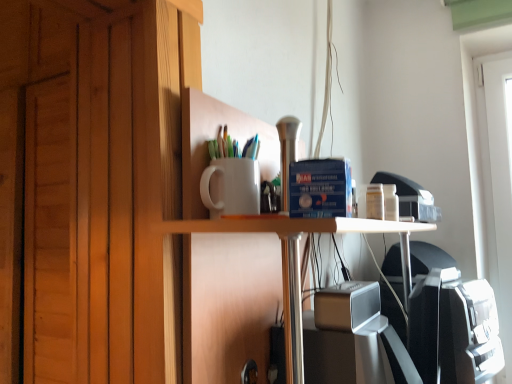
Question: Is white matte cup at upper center to the left or to the right of white glossy table at center in the image?

Choices:
 (A) right
 (B) left

Answer: (B)

Question: Considering the positions of point (180, 193) and point (174, 223), is point (180, 193) closer or farther from the camera than point (174, 223)?

Choices:
 (A) closer
 (B) farther

Answer: (B)

Question: Which of these objects is positioned closest to the satin silver speaker at center?

Choices:
 (A) white matte cup at upper center
 (B) white glossy table at center

Answer: (B)

Question: Estimate the real-world distances between objects in this image. Which object is closer to the satin silver speaker at center?

Choices:
 (A) white matte cup at upper center
 (B) white glossy table at center

Answer: (B)